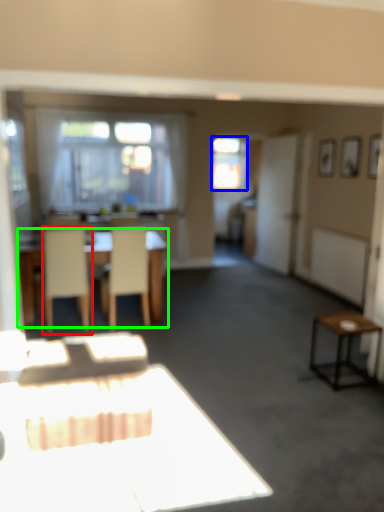
Question: Based on their relative distances, which object is nearer to chair (highlighted by a red box)? Choose from window (highlighted by a blue box) and table (highlighted by a green box).

Choices:
 (A) window
 (B) table

Answer: (B)